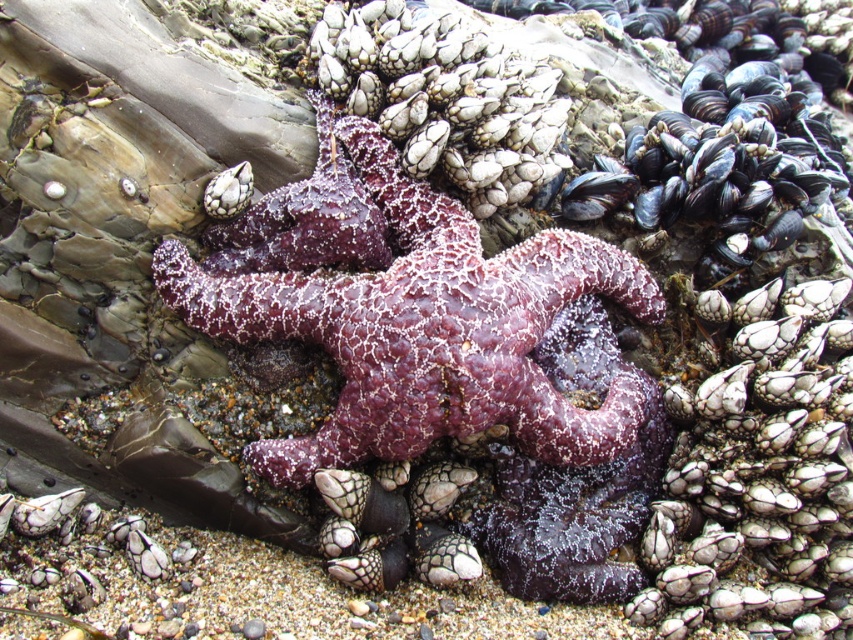
Can you confirm if purple matte starfish at center is wider than purple rough starfish at center?

Correct, the width of purple matte starfish at center exceeds that of purple rough starfish at center.

Can you confirm if purple matte starfish at center is bigger than purple rough starfish at center?

Yes, purple matte starfish at center is bigger than purple rough starfish at center.

What are the coordinates of `purple matte starfish at center` in the screenshot? It's located at (427, 330).